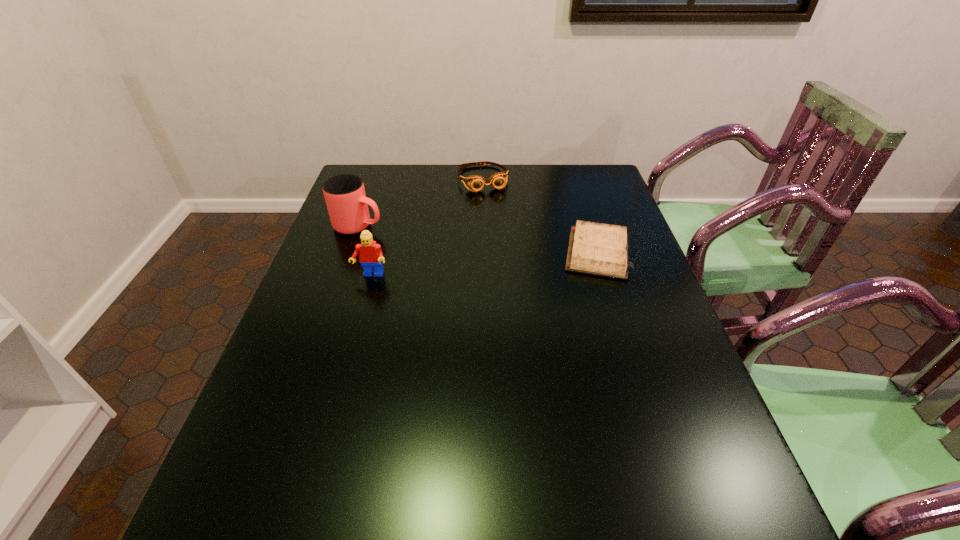
Find the location of a particular element. This screenshot has height=540, width=960. vacant space located 0.220m with the lenses facing forward on the second object from right to left is located at coordinates (505, 231).

I want to click on free space located on the handle side of the cup, so click(x=493, y=261).

The height and width of the screenshot is (540, 960). In order to click on vacant space located 0.090m on the handle side of the cup in this screenshot , I will do `click(407, 237)`.

Identify the location of vacant space located 0.150m on the handle side of the cup. Image resolution: width=960 pixels, height=540 pixels. (424, 242).

Locate an element on the screen. object positioned at the far edge is located at coordinates (498, 180).

Image resolution: width=960 pixels, height=540 pixels. What are the coordinates of `Lego present at the left edge` in the screenshot? It's located at (370, 254).

Identify the location of cup that is at the left edge. The height and width of the screenshot is (540, 960). (347, 204).

This screenshot has height=540, width=960. I want to click on object that is at the right edge, so click(x=598, y=249).

You are a GUI agent. You are given a task and a screenshot of the screen. Output one action in this format:
    pyautogui.click(x=<x>, y=<y>)
    Task: Click on the vacant space at the far edge of the desktop
    
    Given the screenshot: What is the action you would take?
    pyautogui.click(x=554, y=171)

You are a GUI agent. You are given a task and a screenshot of the screen. Output one action in this format:
    pyautogui.click(x=<x>, y=<y>)
    Task: Click on the free spot at the near edge of the desktop
    The width and height of the screenshot is (960, 540).
    Given the screenshot: What is the action you would take?
    pyautogui.click(x=517, y=451)